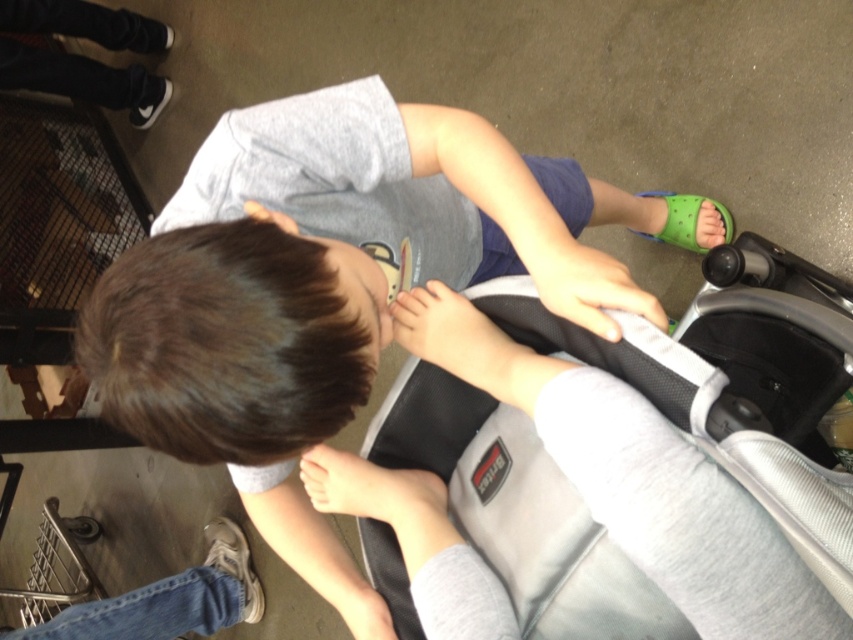
You are a parent holding a 18 inch long gift box and want to place it inside the gray mesh baby carriage at center. Can the gift box fit inside the carriage?

The gray mesh baby carriage at center has a depth of 19.19 inches from the viewer. Since the gift box is 18 inches long, it should fit inside the carriage as it is shorter than the available space.

You are a parent trying to choose between two items in a store. You see the gray mesh baby carriage at center and the gray fabric shirt at center. Based on their sizes, which item is more suitable for storing in a small closet?

The gray mesh baby carriage at center is smaller than the gray fabric shirt at center, so it would be more suitable for storing in a small closet.